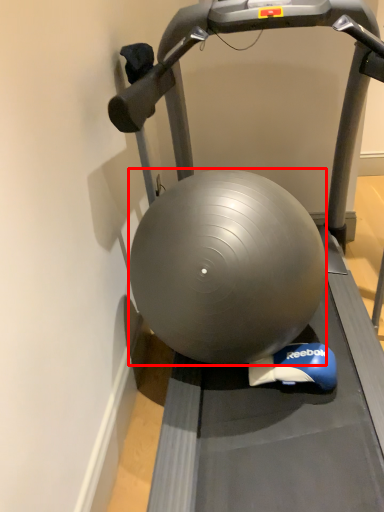
Question: From the image's perspective, where is ball (annotated by the red box) located relative to treadmill?

Choices:
 (A) above
 (B) below

Answer: (B)